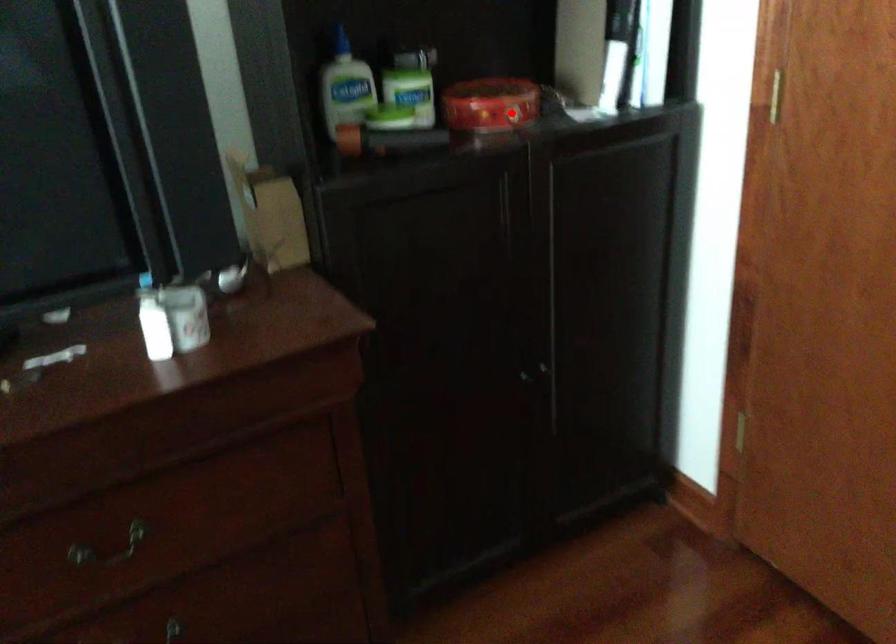
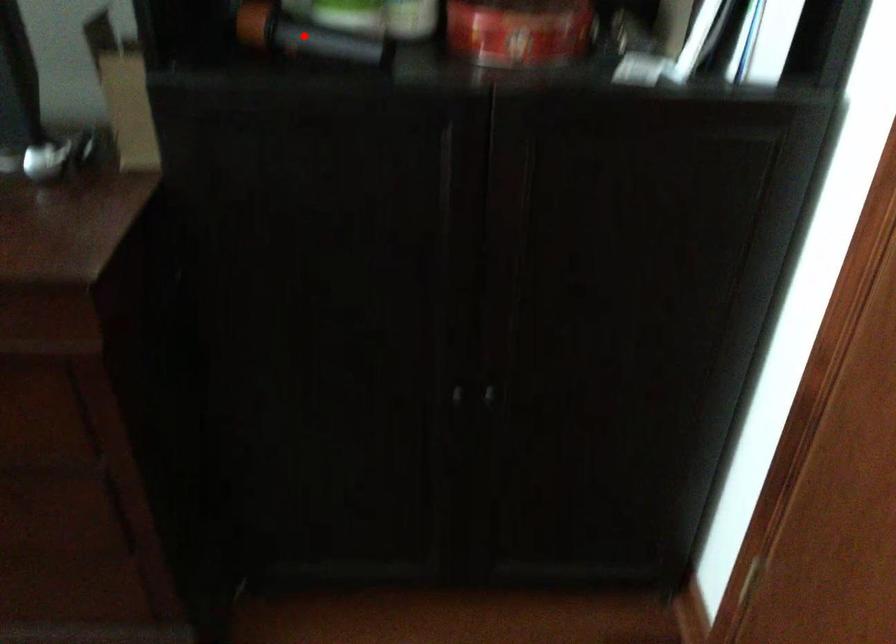
I am providing you with two images of the same scene from different viewpoints. A red point is marked on the first image and another point is marked on the second image. Do the highlighted points in image1 and image2 indicate the same real-world spot?

No